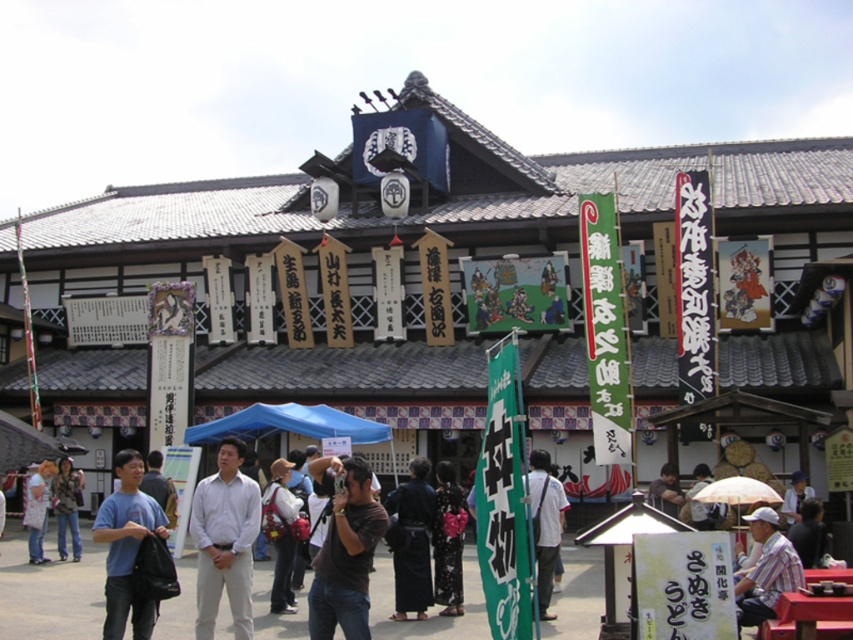
Does white cotton shirt at center appear on the right side of striped cotton shirt at lower right?

No, white cotton shirt at center is not to the right of striped cotton shirt at lower right.

Is white cotton shirt at center positioned in front of striped cotton shirt at lower right?

That is False.

Where is `white cotton shirt at center`? The image size is (853, 640). white cotton shirt at center is located at coordinates point(225,540).

Who is positioned more to the right, white cotton shirt at center or blue fabric canopy at center?

blue fabric canopy at center

Is white cotton shirt at center shorter than blue fabric canopy at center?

Incorrect, white cotton shirt at center's height does not fall short of blue fabric canopy at center's.

Which is behind, point (241, 588) or point (302, 428)?

Positioned behind is point (302, 428).

Locate an element on the screen. white cotton shirt at center is located at coordinates point(225,540).

Can you confirm if blue fabric canopy at center is thinner than camouflage jacket at lower left?

In fact, blue fabric canopy at center might be wider than camouflage jacket at lower left.

Can you confirm if blue fabric canopy at center is bigger than camouflage jacket at lower left?

Incorrect, blue fabric canopy at center is not larger than camouflage jacket at lower left.

This screenshot has width=853, height=640. Describe the element at coordinates (288, 424) in the screenshot. I see `blue fabric canopy at center` at that location.

Find the location of a particular element. The width and height of the screenshot is (853, 640). blue fabric canopy at center is located at coordinates (288, 424).